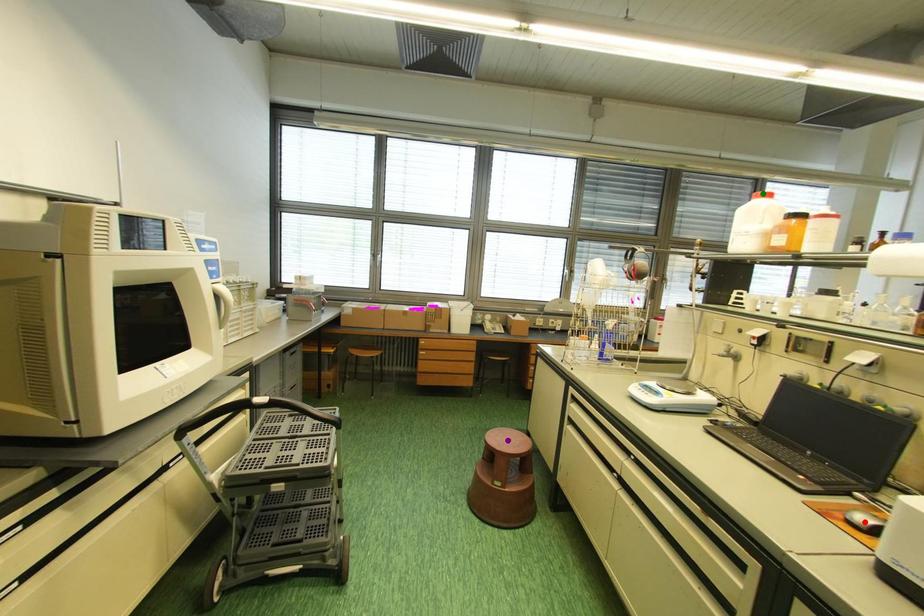
Order these from nearest to farthest:
A) green point
B) purple point
C) red point

red point < purple point < green point